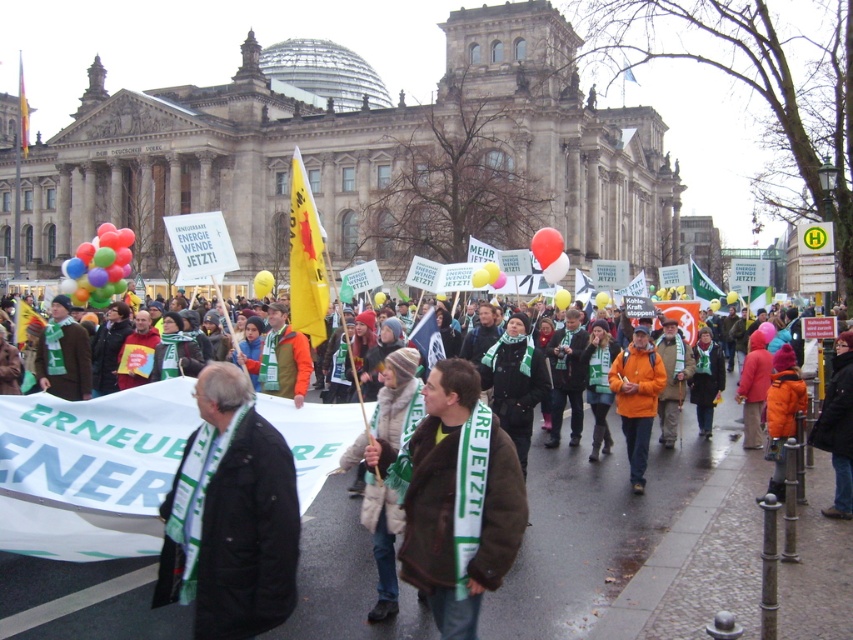
You are a photographer at the protest. You want to capture a photo that includes both the multicolored balloons at left and the translucent red balloon at center. Which balloon group will appear larger in the photo?

The multicolored balloons at left will appear larger in the photo because they are bigger than the translucent red balloon at center according to the description.